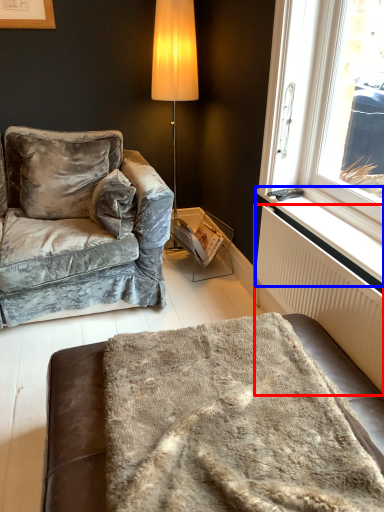
Question: Among these objects, which one is nearest to the camera, radiator (highlighted by a red box) or window sill (highlighted by a blue box)?

Choices:
 (A) radiator
 (B) window sill

Answer: (A)